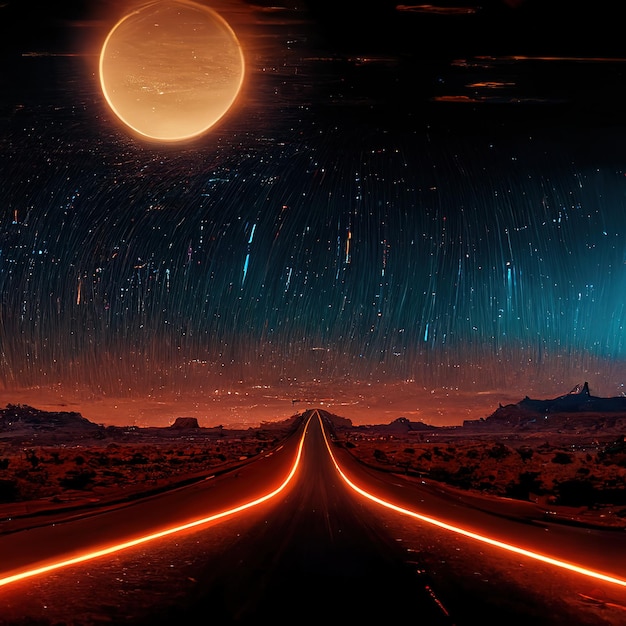
Locate an element on the screen. This screenshot has width=626, height=626. mesas is located at coordinates (404, 422), (186, 419), (339, 423).